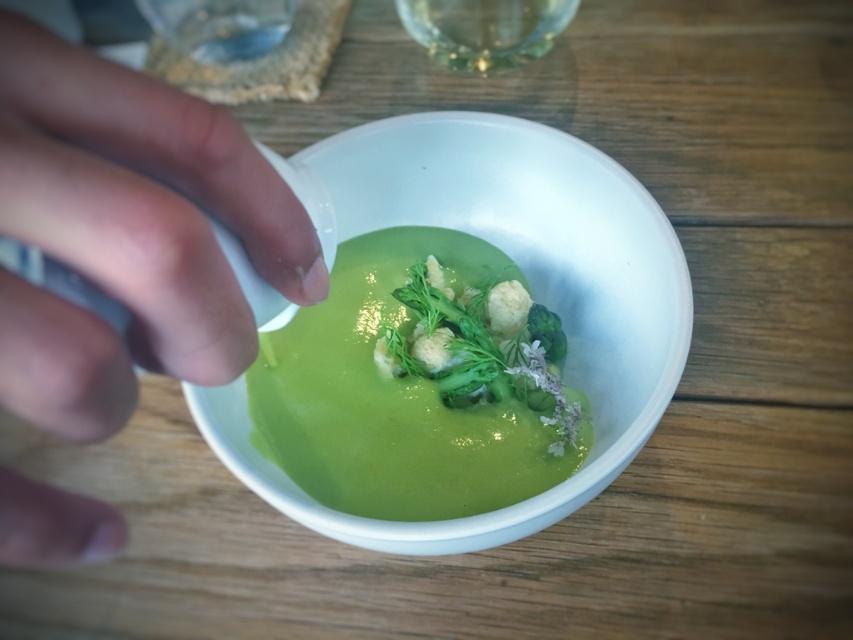
Consider the image. You are a chef preparing to serve a dish. You have a matte white hand at left and a white glossy bowl at center in front of you. Which object has a smaller width?

The matte white hand at left has a smaller width than the white glossy bowl at center.

You are a photographer trying to capture a closeup of the soup in the bowl. You need to adjust your camera so that the focal point is exactly at point [437,124]. What is the minimum distance you should set your camera lens to focus at to ensure the point is in sharp focus?

The distance of point [437,124] from the camera is 45.99 centimeters, so you should set your camera lens to focus at 45.99 centimeters to ensure the point is in sharp focus.

In the scene shown: You are a chef preparing a dish and see the matte white hand at left and the white glossy bowl at center. Which object is closer to you?

The matte white hand at left is closer to you because it is shorter than the white glossy bowl at center.